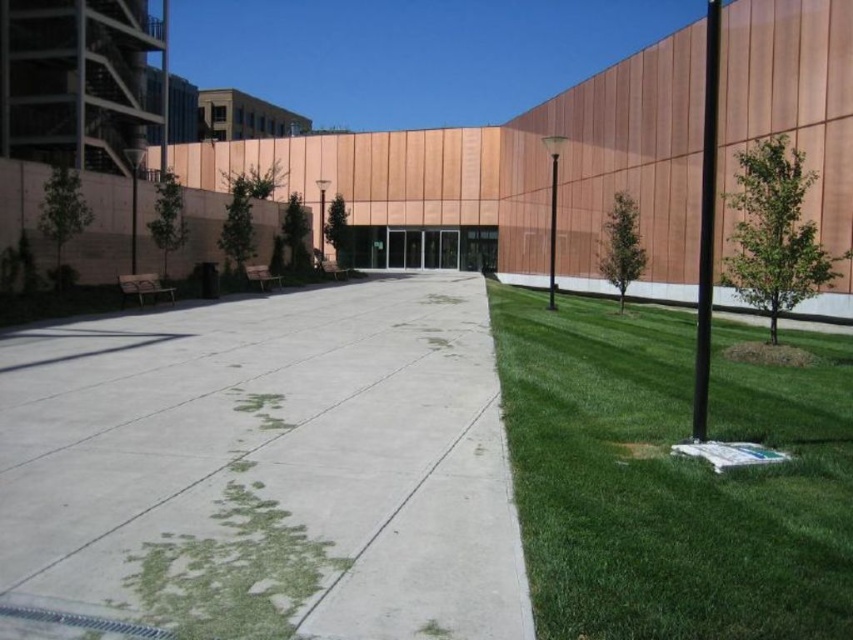
You are standing at the bottom left corner of the image where the pathway starts. You want to walk towards the building entrance. Which surface will you step on first, the white concrete pavement at center or the green grass at right?

The white concrete pavement at center is positioned over the green grass at right, so you will step on the white concrete pavement at center first as it is directly in front of you.

In the scene shown: You are a delivery person with a cart that is 2 meters wide. You need to move from the white concrete pavement at center to the green grass at right. Is there enough space between them for your cart to pass through?

The white concrete pavement at center and green grass at right are 3.41 meters apart, so yes, the cart can pass through the space between them since it is wider than the cart.